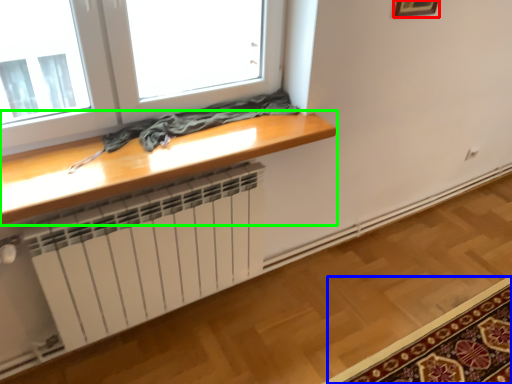
Question: Considering the real-world distances, which object is closest to picture frame (highlighted by a red box)? mat (highlighted by a blue box) or table (highlighted by a green box).

Choices:
 (A) mat
 (B) table

Answer: (B)